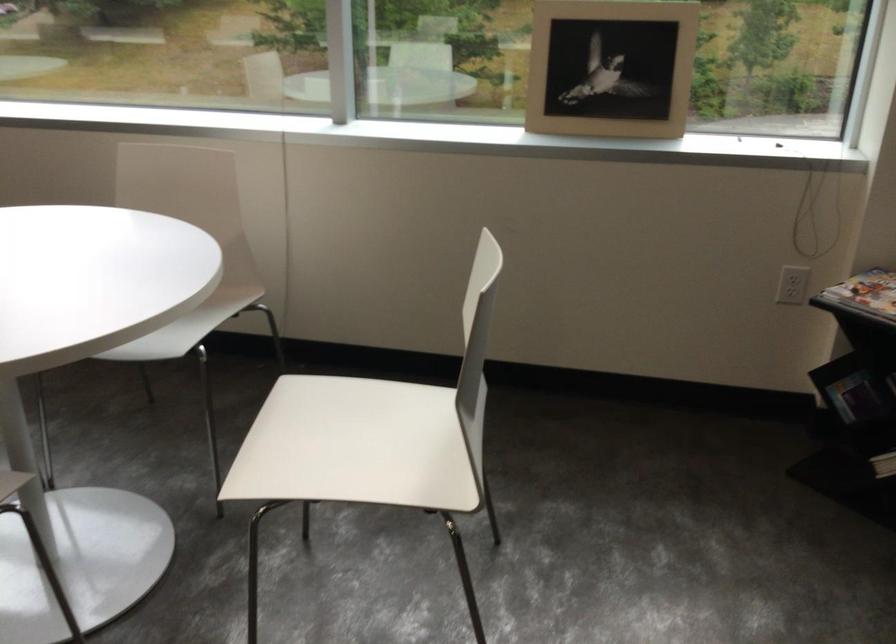
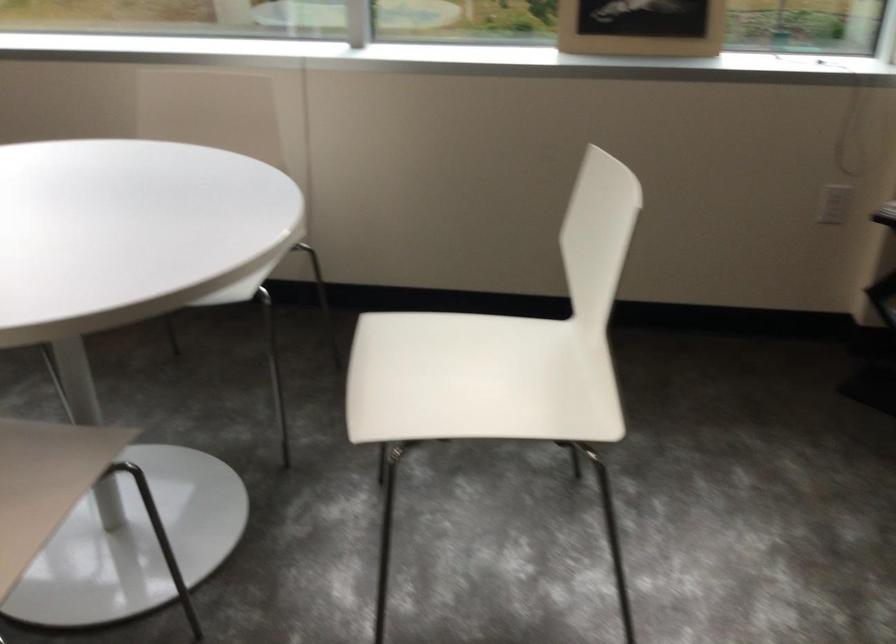
Question: How did the camera likely rotate?

Choices:
 (A) Left
 (B) Right
 (C) Up
 (D) Down

Answer: (B)